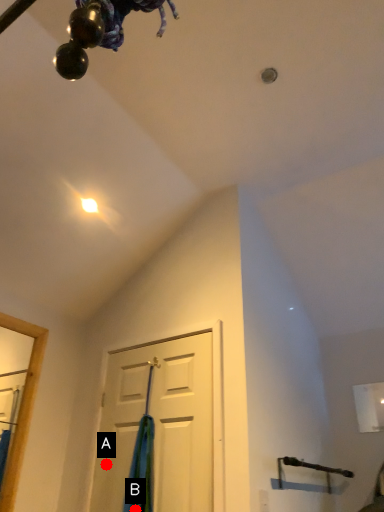
Question: Two points are circled on the image, labeled by A and B beside each circle. Which point is farther from the camera taking this photo?

Choices:
 (A) A is further
 (B) B is further

Answer: (A)